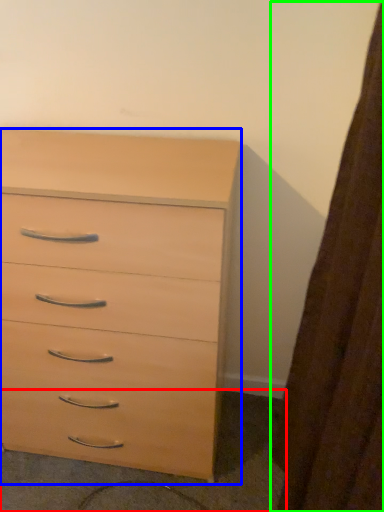
Question: Based on their relative distances, which object is nearer to concrete (highlighted by a red box)? Choose from chest of drawers (highlighted by a blue box) and curtain (highlighted by a green box).

Choices:
 (A) chest of drawers
 (B) curtain

Answer: (A)